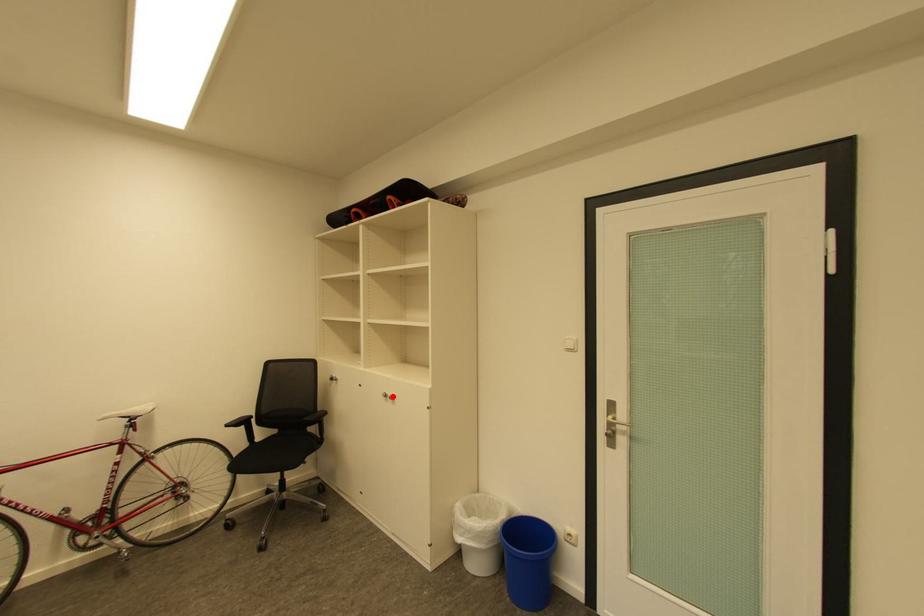
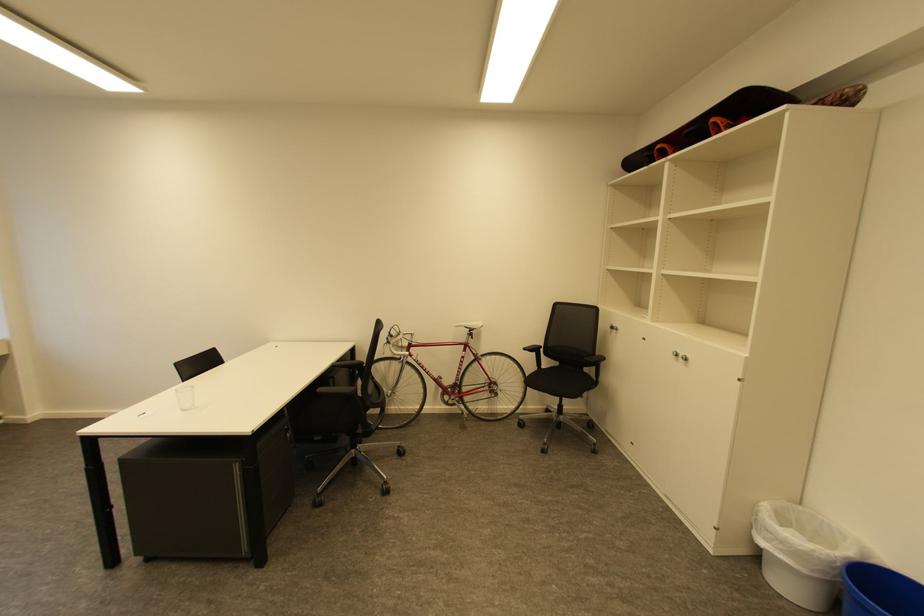
Find the pixel in the second image that matches the highlighted location in the first image.

(684, 355)